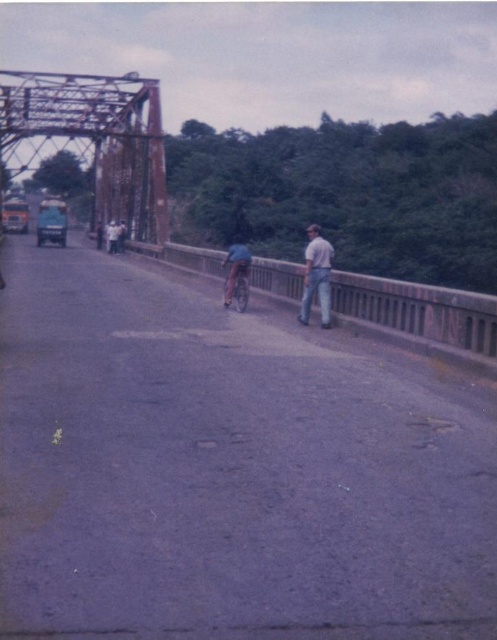
Question: Can you confirm if light brown shirt at center is positioned below metallic green truck at left?

Choices:
 (A) yes
 (B) no

Answer: (A)

Question: Which point is closer to the camera taking this photo?

Choices:
 (A) (242, 280)
 (B) (2, 227)
 (C) (114, 168)
 (D) (114, 252)

Answer: (A)

Question: Which object is closer to the camera taking this photo?

Choices:
 (A) shiny blue bicycle at center
 (B) rusty metal bridge at left

Answer: (A)

Question: Is metallic blue car at left to the left of metallic green truck at left from the viewer's perspective?

Choices:
 (A) yes
 (B) no

Answer: (B)

Question: In this image, where is light brown shirt at center located relative to metallic green truck at left?

Choices:
 (A) above
 (B) below

Answer: (B)

Question: Which object is the farthest from the light brown shirt at center?

Choices:
 (A) matte asphalt bike path at center
 (B) metallic blue car at left
 (C) shiny blue bicycle at center
 (D) rusty metal bridge at left

Answer: (D)